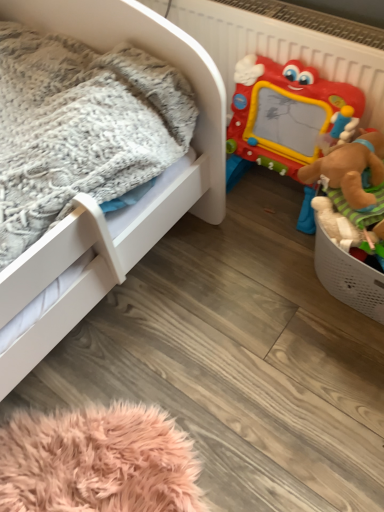
Locate an element on the screen. This screenshot has height=512, width=384. free space that is to the left of plastic drawing board at right is located at coordinates (196, 250).